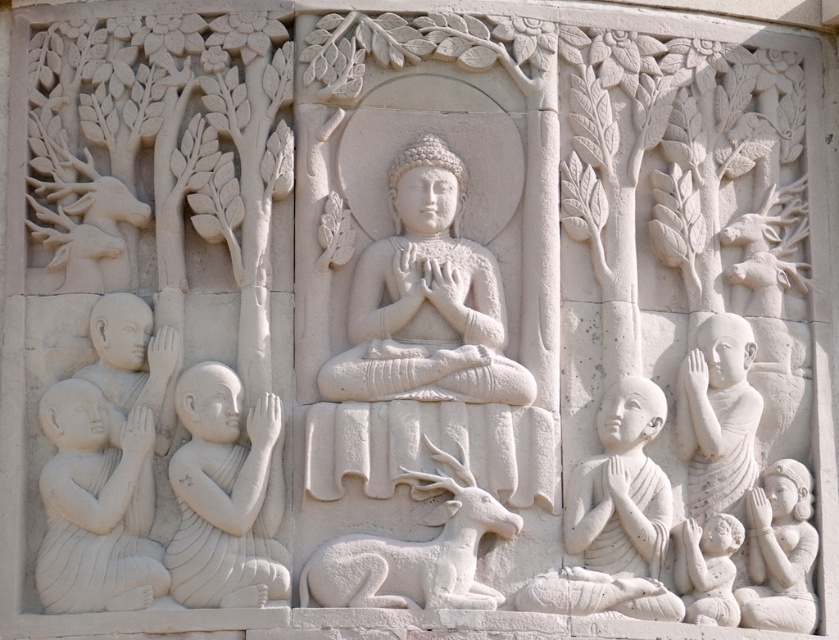
Question: Which point is closer to the camera?

Choices:
 (A) (210, 589)
 (B) (431, 566)

Answer: (B)

Question: Can you confirm if white stone woman at lower right is wider than smooth white child at lower right?

Choices:
 (A) no
 (B) yes

Answer: (A)

Question: Does white stone buddha at center lie behind white stone monk at lower right?

Choices:
 (A) no
 (B) yes

Answer: (B)

Question: Which object is positioned closest to the white stone monk at lower right?

Choices:
 (A) white stone deer at center
 (B) smooth white child at lower right
 (C) white stone woman at lower right
 (D) white stone figure at lower left

Answer: (B)

Question: Can you confirm if white stone monk at lower right is bigger than white stone monk at right?

Choices:
 (A) no
 (B) yes

Answer: (B)

Question: Which point is farther to the camera?

Choices:
 (A) (603, 408)
 (B) (258, 460)
 (C) (731, 422)

Answer: (C)